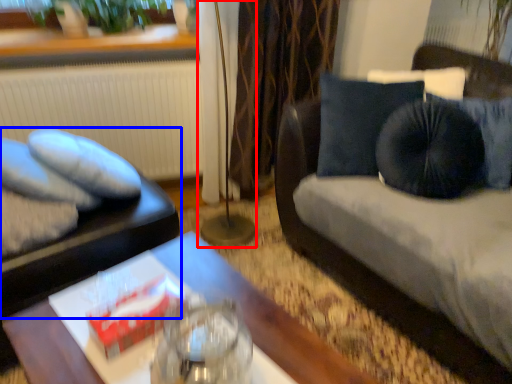
Question: Which of the following is the closest to the observer, lamp (highlighted by a red box) or furniture (highlighted by a blue box)?

Choices:
 (A) lamp
 (B) furniture

Answer: (B)